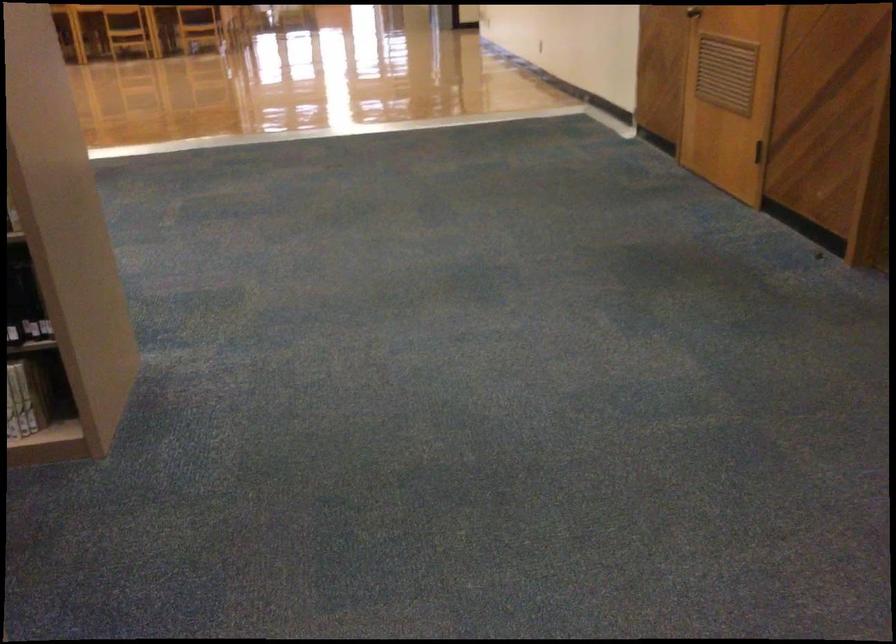
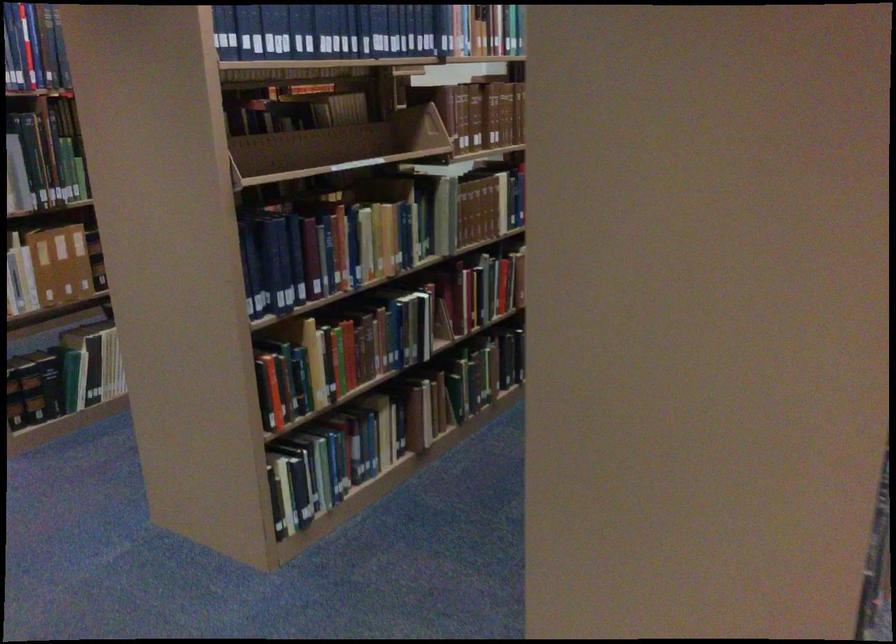
Question: I am providing you with two images of the same scene from different viewpoints. Which of the following objects are not visible in image2?

Choices:
 (A) book on shelf
 (B) green book
 (C) yellow book
 (D) blue ribbon

Answer: (A)